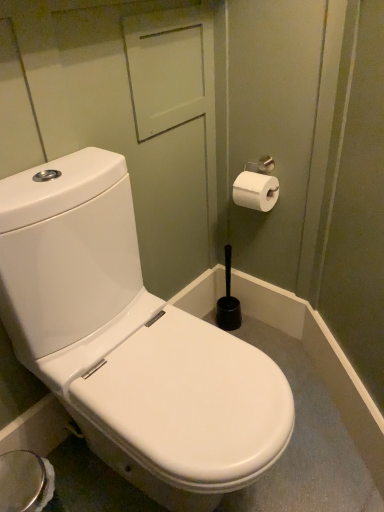
Question: Would you say white matte toilet paper at upper right is part of white glossy toilet at center's contents?

Choices:
 (A) no
 (B) yes

Answer: (A)

Question: Is white glossy toilet at center directly adjacent to white matte toilet paper at upper right?

Choices:
 (A) no
 (B) yes

Answer: (A)

Question: Is white glossy toilet at center wider than white matte toilet paper at upper right?

Choices:
 (A) no
 (B) yes

Answer: (B)

Question: Does white glossy toilet at center have a lesser width compared to white matte toilet paper at upper right?

Choices:
 (A) yes
 (B) no

Answer: (B)

Question: Is white matte toilet paper at upper right at the back of white glossy toilet at center?

Choices:
 (A) yes
 (B) no

Answer: (B)

Question: Considering the relative sizes of white glossy toilet at center and white matte toilet paper at upper right in the image provided, is white glossy toilet at center bigger than white matte toilet paper at upper right?

Choices:
 (A) no
 (B) yes

Answer: (B)

Question: Can you confirm if white matte toilet paper at upper right is thinner than white glossy toilet at center?

Choices:
 (A) no
 (B) yes

Answer: (B)

Question: Considering the relative sizes of white matte toilet paper at upper right and white glossy toilet at center in the image provided, is white matte toilet paper at upper right wider than white glossy toilet at center?

Choices:
 (A) yes
 (B) no

Answer: (B)

Question: Is white matte toilet paper at upper right facing towards white glossy toilet at center?

Choices:
 (A) no
 (B) yes

Answer: (B)

Question: Is white matte toilet paper at upper right next to white glossy toilet at center?

Choices:
 (A) yes
 (B) no

Answer: (B)

Question: Are white matte toilet paper at upper right and white glossy toilet at center located far from each other?

Choices:
 (A) yes
 (B) no

Answer: (B)

Question: Considering the relative positions of white matte toilet paper at upper right and white glossy toilet at center in the image provided, is white matte toilet paper at upper right to the left of white glossy toilet at center from the viewer's perspective?

Choices:
 (A) no
 (B) yes

Answer: (A)

Question: From their relative heights in the image, would you say white matte toilet paper at upper right is taller or shorter than white glossy toilet at center?

Choices:
 (A) tall
 (B) short

Answer: (B)